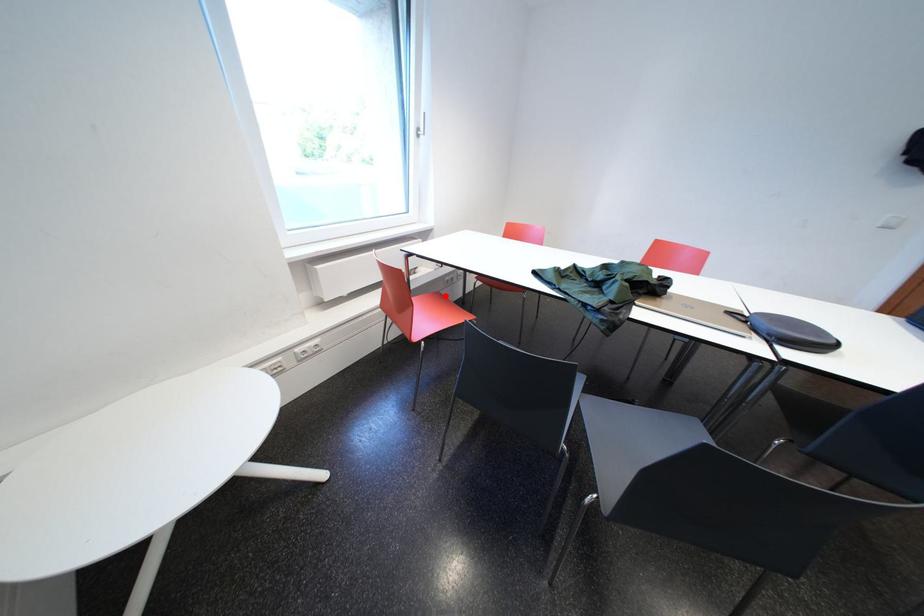
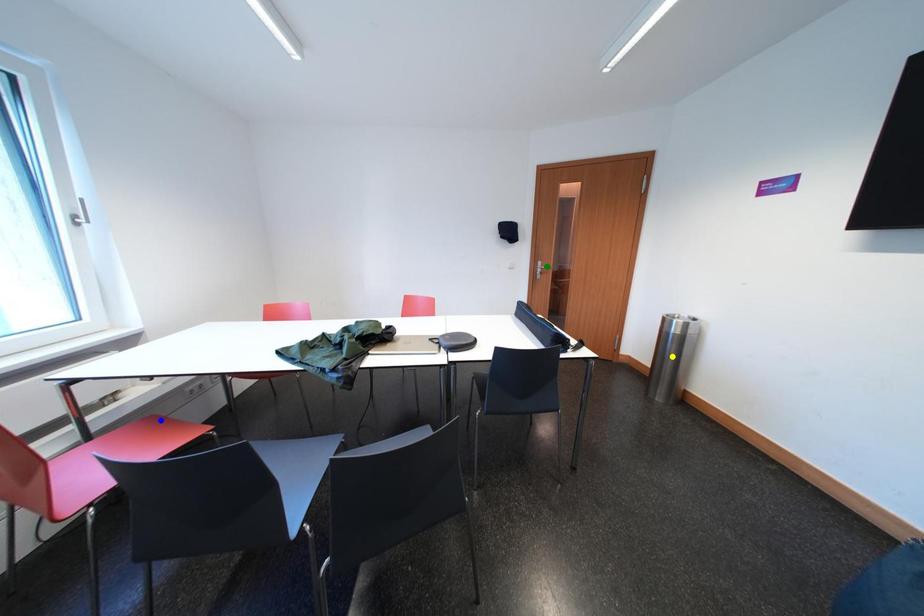
Question: I am providing you with two images of the same scene from different viewpoints. A red point is marked on the first image. You are given multiple points on the second image. Which point in image 2 represents the same 3d spot as the red point in image 1?

Choices:
 (A) green point
 (B) yellow point
 (C) blue point

Answer: (C)